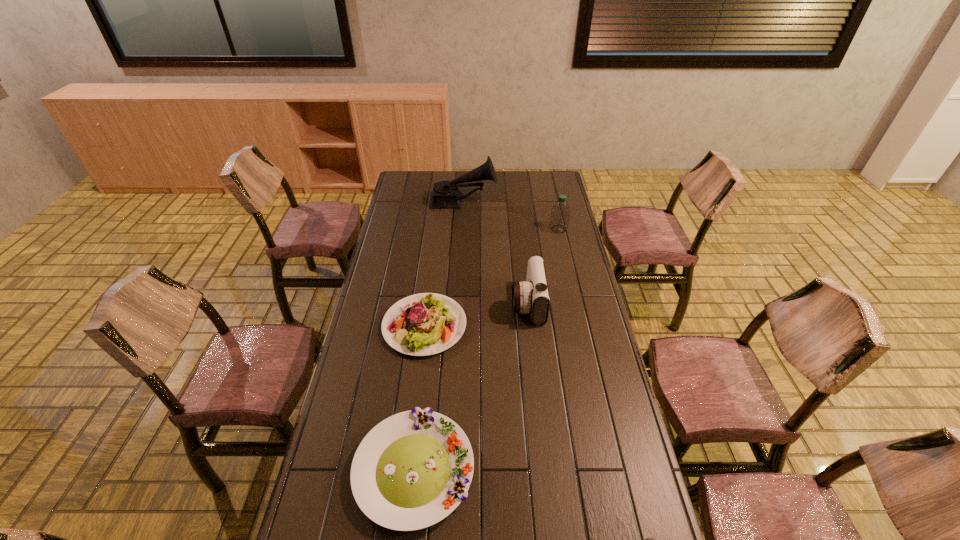
The image size is (960, 540). In order to click on phonograph_record in this screenshot , I will do `click(445, 194)`.

The width and height of the screenshot is (960, 540). Identify the location of the tallest object. (445, 194).

I want to click on water bottle, so click(x=560, y=212).

Find the location of a particular element. Image resolution: width=960 pixels, height=540 pixels. camcorder is located at coordinates (531, 297).

Where is `the farther salad plate`? The height and width of the screenshot is (540, 960). the farther salad plate is located at coordinates (423, 324).

Image resolution: width=960 pixels, height=540 pixels. Find the location of `the third shortest object`. the third shortest object is located at coordinates (423, 324).

I want to click on the nearer salad plate, so click(x=413, y=469).

The width and height of the screenshot is (960, 540). Find the location of `the shorter salad plate`. the shorter salad plate is located at coordinates (413, 469).

Identify the location of free space located 0.090m from the horn of the tallest object. tap(514, 202).

Identify the location of vacant space located on the left of the second farthest object. (530, 229).